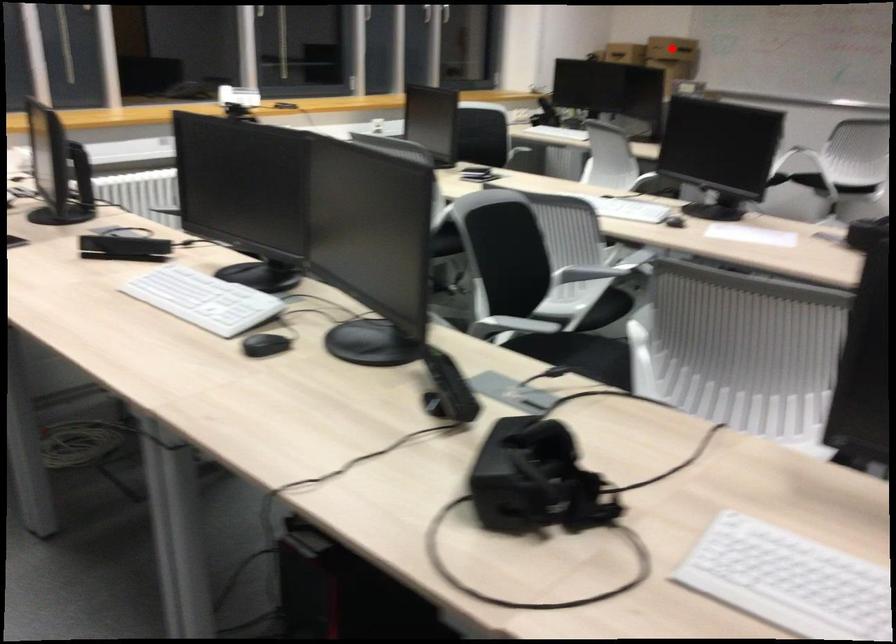
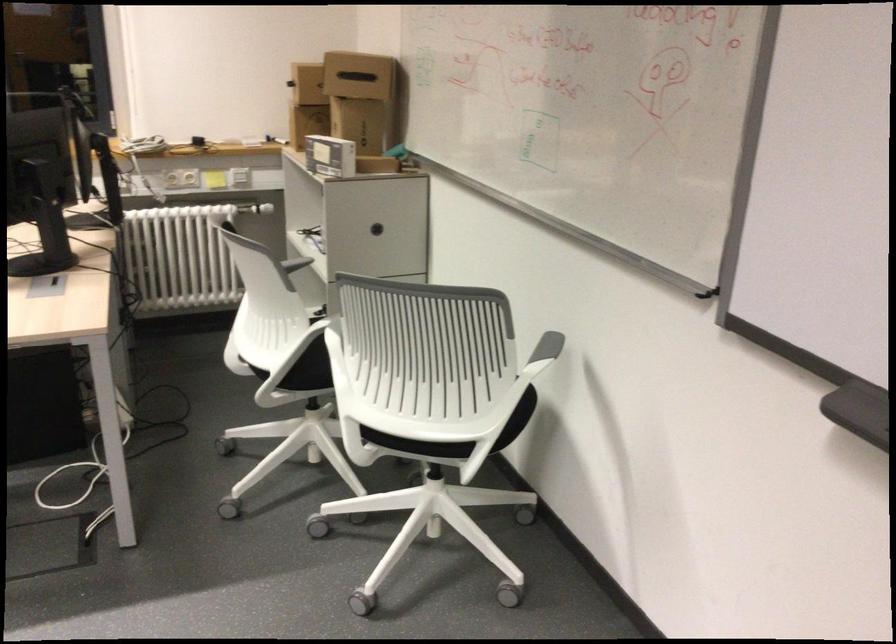
Question: I am providing you with two images of the same scene from different viewpoints. A red point is marked on the first image. At the location where the point appears in image 1, is it still visible in image 2?

Choices:
 (A) Yes
 (B) No

Answer: (B)